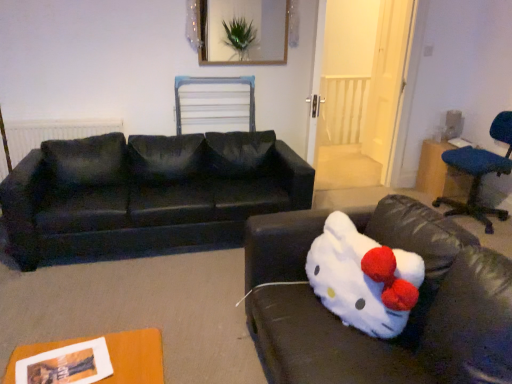
Question: From a real-world perspective, is black fabric couch at left, the second studio couch viewed from the front, under blue fabric table at right?

Choices:
 (A) no
 (B) yes

Answer: (A)

Question: From a real-world perspective, is black fabric couch at left, the first studio couch positioned from the back, located higher than blue fabric table at right?

Choices:
 (A) yes
 (B) no

Answer: (A)

Question: Considering the relative sizes of black fabric couch at left, the second studio couch viewed from the front, and blue fabric table at right in the image provided, is black fabric couch at left, the second studio couch viewed from the front, shorter than blue fabric table at right?

Choices:
 (A) yes
 (B) no

Answer: (B)

Question: Is the surface of black fabric couch at left, the first studio couch positioned from the back, in direct contact with blue fabric table at right?

Choices:
 (A) no
 (B) yes

Answer: (A)

Question: Does black fabric couch at left, the first studio couch positioned from the back, have a greater height compared to blue fabric table at right?

Choices:
 (A) no
 (B) yes

Answer: (B)

Question: Is blue fabric table at right surrounded by black fabric couch at left, the second studio couch viewed from the front?

Choices:
 (A) no
 (B) yes

Answer: (A)

Question: Is blue fabric table at right far from blue fabric chair at right?

Choices:
 (A) yes
 (B) no

Answer: (B)

Question: Is blue fabric table at right positioned behind blue fabric chair at right?

Choices:
 (A) yes
 (B) no

Answer: (A)

Question: Can you confirm if blue fabric table at right is positioned to the right of blue fabric chair at right?

Choices:
 (A) no
 (B) yes

Answer: (A)

Question: Considering the relative sizes of blue fabric table at right and blue fabric chair at right in the image provided, is blue fabric table at right bigger than blue fabric chair at right?

Choices:
 (A) yes
 (B) no

Answer: (B)

Question: From the image's perspective, is blue fabric table at right above blue fabric chair at right?

Choices:
 (A) no
 (B) yes

Answer: (B)

Question: Is blue fabric table at right in front of blue fabric chair at right?

Choices:
 (A) yes
 (B) no

Answer: (B)

Question: Considering the relative sizes of matte black radiator at left and wooden picture frame at upper center in the image provided, is matte black radiator at left taller than wooden picture frame at upper center?

Choices:
 (A) yes
 (B) no

Answer: (A)